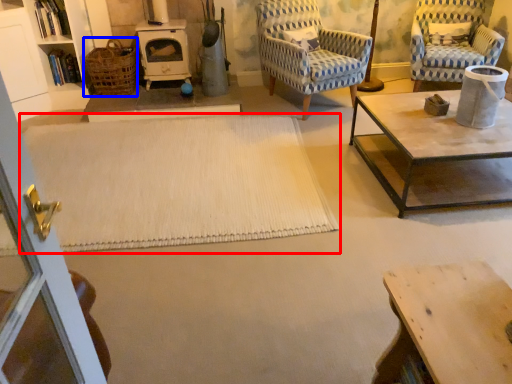
Question: Which point is closer to the camera, plain (highlighted by a red box) or basket (highlighted by a blue box)?

Choices:
 (A) plain
 (B) basket

Answer: (A)